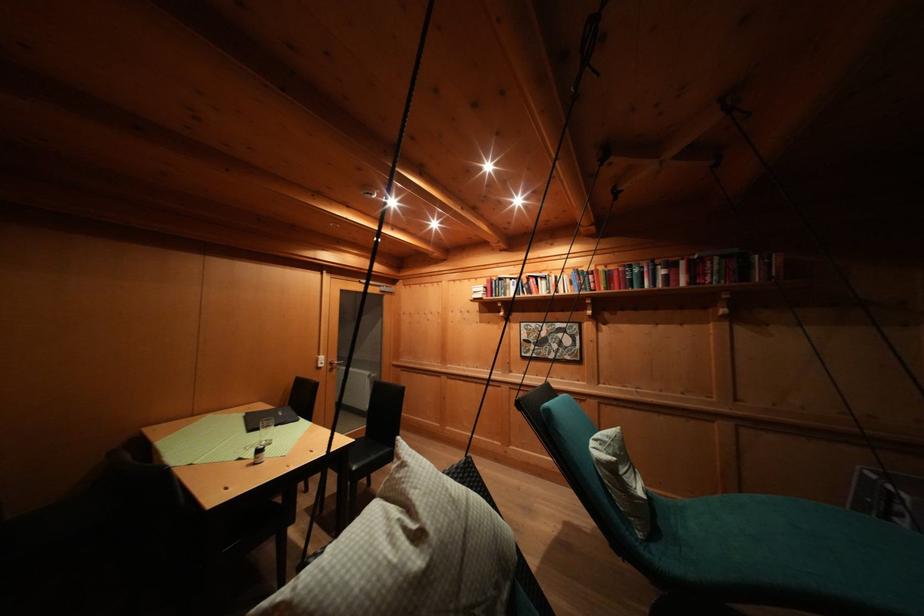
Where would you lift the small glass jar? Please return your answer as a coordinate pair (x, y).

(265, 431)